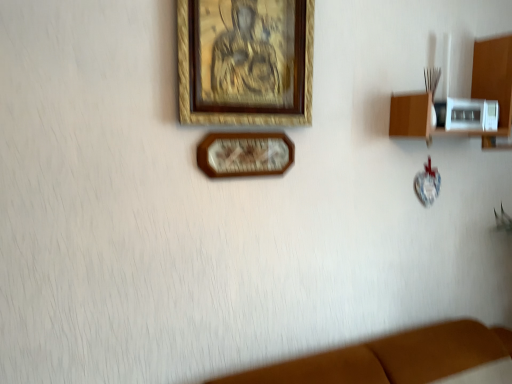
Question: Is wooden shelf at right closer to the viewer compared to wooden clock at center, the 1th picture frame positioned from the bottom?

Choices:
 (A) yes
 (B) no

Answer: (B)

Question: Is wooden shelf at right oriented away from wooden clock at center, positioned as the 2th picture frame in top-to-bottom order?

Choices:
 (A) no
 (B) yes

Answer: (A)

Question: Is wooden shelf at right not within wooden clock at center, the 1th picture frame positioned from the bottom?

Choices:
 (A) yes
 (B) no

Answer: (A)

Question: Are wooden shelf at right and wooden clock at center, the 1th picture frame positioned from the bottom, far apart?

Choices:
 (A) yes
 (B) no

Answer: (B)

Question: Is wooden shelf at right taller than wooden clock at center, the 1th picture frame positioned from the bottom?

Choices:
 (A) no
 (B) yes

Answer: (B)

Question: From a real-world perspective, relative to wooden clock at center, positioned as the 2th picture frame in top-to-bottom order, is wooden picture frame at upper center, acting as the first picture frame starting from the top, vertically above or below?

Choices:
 (A) above
 (B) below

Answer: (A)

Question: Considering the positions of wooden picture frame at upper center, acting as the first picture frame starting from the top, and wooden clock at center, positioned as the 2th picture frame in top-to-bottom order, in the image, is wooden picture frame at upper center, acting as the first picture frame starting from the top, taller or shorter than wooden clock at center, positioned as the 2th picture frame in top-to-bottom order,?

Choices:
 (A) tall
 (B) short

Answer: (A)

Question: Looking at their shapes, would you say wooden picture frame at upper center, positioned as the 2th picture frame in bottom-to-top order, is wider or thinner than wooden clock at center, the 1th picture frame positioned from the bottom?

Choices:
 (A) thin
 (B) wide

Answer: (B)

Question: Based on their sizes in the image, would you say wooden picture frame at upper center, positioned as the 2th picture frame in bottom-to-top order, is bigger or smaller than wooden clock at center, the 1th picture frame positioned from the bottom?

Choices:
 (A) big
 (B) small

Answer: (A)

Question: Considering the positions of point (283, 145) and point (201, 54), is point (283, 145) closer or farther from the camera than point (201, 54)?

Choices:
 (A) closer
 (B) farther

Answer: (B)

Question: Is wooden clock at center, positioned as the 2th picture frame in top-to-bottom order, in front of or behind wooden picture frame at upper center, acting as the first picture frame starting from the top, in the image?

Choices:
 (A) behind
 (B) front

Answer: (A)

Question: From a real-world perspective, relative to wooden picture frame at upper center, positioned as the 2th picture frame in bottom-to-top order, is wooden clock at center, the 1th picture frame positioned from the bottom, vertically above or below?

Choices:
 (A) below
 (B) above

Answer: (A)

Question: Is wooden clock at center, the 1th picture frame positioned from the bottom, taller or shorter than wooden picture frame at upper center, acting as the first picture frame starting from the top?

Choices:
 (A) tall
 (B) short

Answer: (B)

Question: Considering their positions, is wooden clock at center, positioned as the 2th picture frame in top-to-bottom order, located in front of or behind wooden shelf at right?

Choices:
 (A) behind
 (B) front

Answer: (B)

Question: Considering the positions of point (258, 142) and point (419, 125), is point (258, 142) closer or farther from the camera than point (419, 125)?

Choices:
 (A) closer
 (B) farther

Answer: (A)